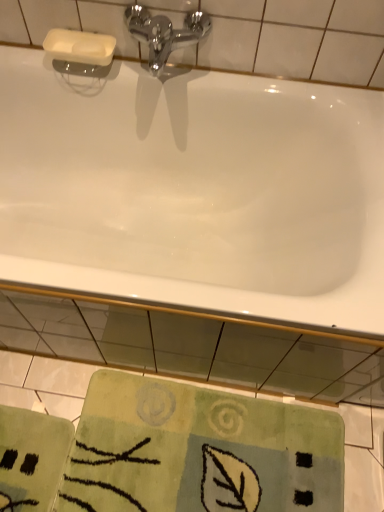
Question: From a real-world perspective, does green textured rug at lower center stand above chrome metallic faucet at upper center?

Choices:
 (A) yes
 (B) no

Answer: (B)

Question: Is the position of green textured rug at lower center more distant than that of chrome metallic faucet at upper center?

Choices:
 (A) yes
 (B) no

Answer: (A)

Question: Can you confirm if green textured rug at lower center is shorter than chrome metallic faucet at upper center?

Choices:
 (A) no
 (B) yes

Answer: (B)

Question: From a real-world perspective, is green textured rug at lower center physically below chrome metallic faucet at upper center?

Choices:
 (A) no
 (B) yes

Answer: (B)

Question: Is green textured rug at lower center wider than chrome metallic faucet at upper center?

Choices:
 (A) no
 (B) yes

Answer: (B)

Question: In the image, is white glossy bathtub at upper center positioned in front of or behind chrome metallic faucet at upper center?

Choices:
 (A) front
 (B) behind

Answer: (A)

Question: Based on their positions, is white glossy bathtub at upper center located to the left or right of chrome metallic faucet at upper center?

Choices:
 (A) right
 (B) left

Answer: (B)

Question: From the image's perspective, relative to chrome metallic faucet at upper center, is white glossy bathtub at upper center above or below?

Choices:
 (A) above
 (B) below

Answer: (B)

Question: Is white glossy bathtub at upper center taller or shorter than chrome metallic faucet at upper center?

Choices:
 (A) tall
 (B) short

Answer: (A)

Question: In terms of width, does chrome metallic faucet at upper center look wider or thinner when compared to green textured rug at lower center?

Choices:
 (A) thin
 (B) wide

Answer: (A)

Question: From a real-world perspective, relative to green textured rug at lower center, is chrome metallic faucet at upper center vertically above or below?

Choices:
 (A) above
 (B) below

Answer: (A)

Question: Is point (175, 48) closer or farther from the camera than point (249, 412)?

Choices:
 (A) farther
 (B) closer

Answer: (B)

Question: Considering their positions, is chrome metallic faucet at upper center located in front of or behind green textured rug at lower center?

Choices:
 (A) front
 (B) behind

Answer: (A)

Question: Considering the relative positions of green textured rug at lower center and white glossy bathtub at upper center in the image provided, is green textured rug at lower center to the left or to the right of white glossy bathtub at upper center?

Choices:
 (A) right
 (B) left

Answer: (A)

Question: Considering the positions of green textured rug at lower center and white glossy bathtub at upper center in the image, is green textured rug at lower center bigger or smaller than white glossy bathtub at upper center?

Choices:
 (A) small
 (B) big

Answer: (A)